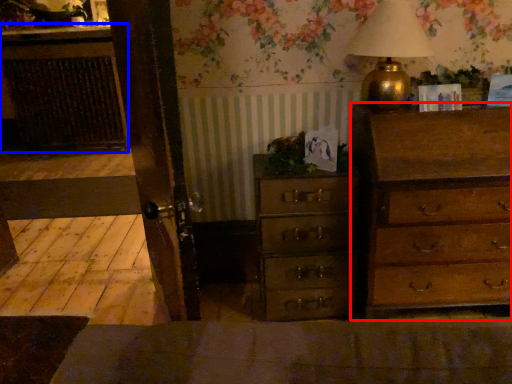
Question: Among these objects, which one is nearest to the camera, chest of drawers (highlighted by a red box) or cabinetry (highlighted by a blue box)?

Choices:
 (A) chest of drawers
 (B) cabinetry

Answer: (A)